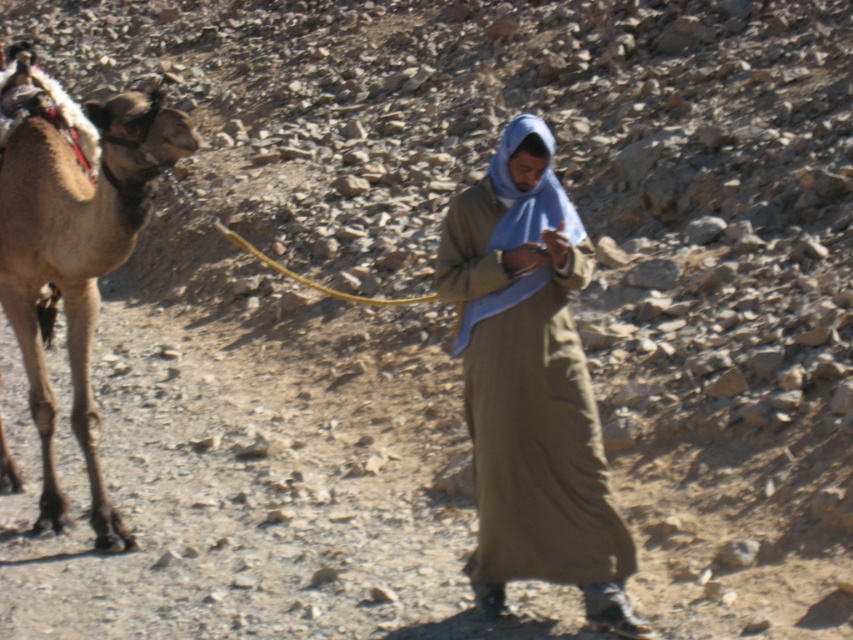
Question: Among these points, which one is farthest from the camera?

Choices:
 (A) (451, 342)
 (B) (106, 234)

Answer: (A)

Question: Which point is farther to the camera?

Choices:
 (A) brown textured camel at left
 (B) olive-green fabric robe at center

Answer: (A)

Question: Is olive-green fabric robe at center to the right of brown textured camel at left from the viewer's perspective?

Choices:
 (A) yes
 (B) no

Answer: (A)

Question: Which object is farther from the camera taking this photo?

Choices:
 (A) olive-green fabric robe at center
 (B) brown textured camel at left

Answer: (B)

Question: Can you confirm if olive-green fabric robe at center is positioned to the right of brown textured camel at left?

Choices:
 (A) no
 (B) yes

Answer: (B)

Question: Is olive-green fabric robe at center further to camera compared to brown textured camel at left?

Choices:
 (A) yes
 (B) no

Answer: (B)